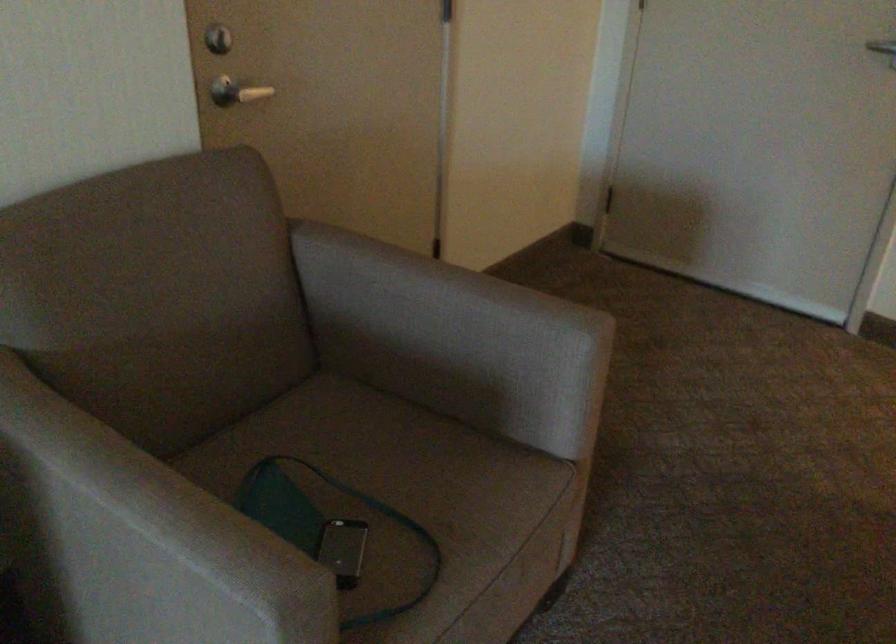
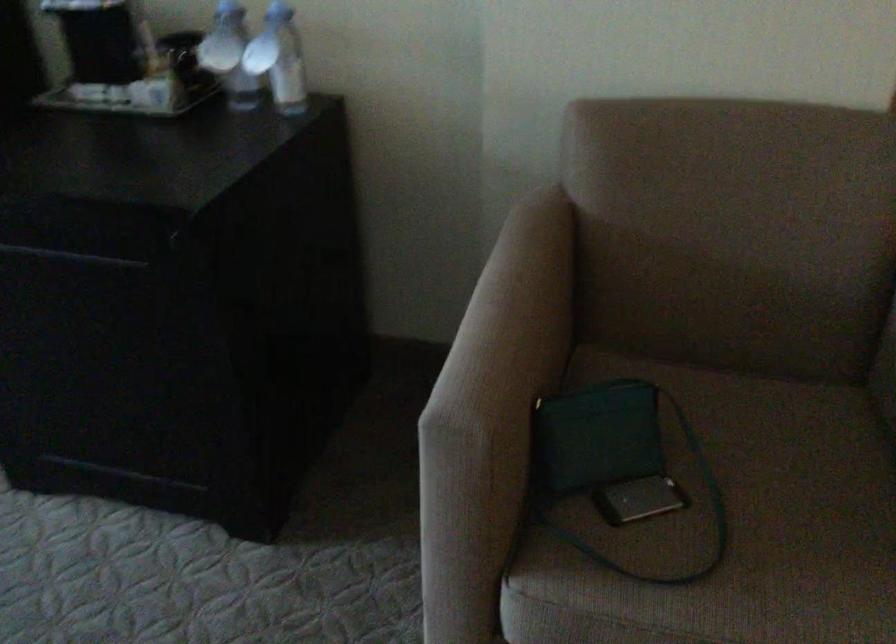
In the second image, find the point that corresponds to pixel 343 556 in the first image.

(639, 500)